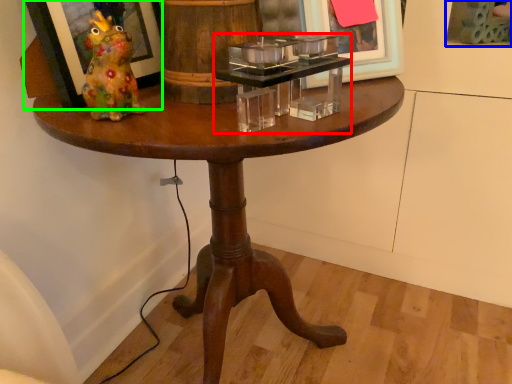
Question: Estimate the real-world distances between objects in this image. Which object is closer to candle holder (highlighted by a red box), picture frame (highlighted by a blue box) or picture frame (highlighted by a green box)?

Choices:
 (A) picture frame
 (B) picture frame

Answer: (B)